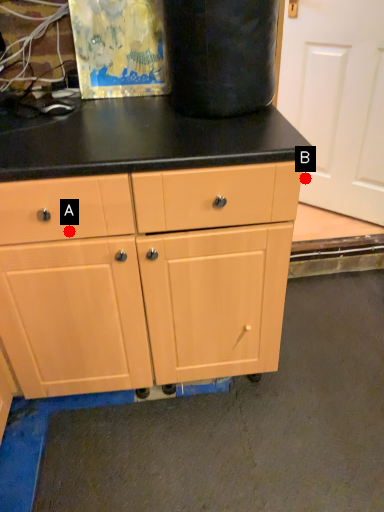
Question: Two points are circled on the image, labeled by A and B beside each circle. Which point appears closest to the camera in this image?

Choices:
 (A) A is closer
 (B) B is closer

Answer: (A)